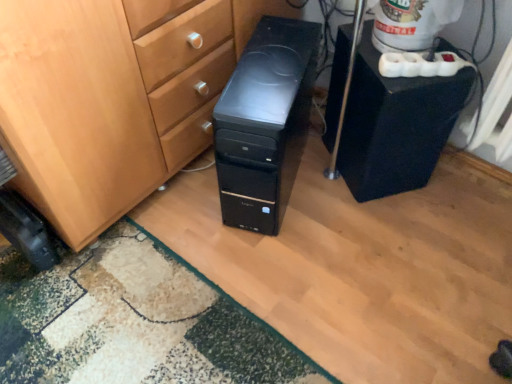
Question: Is point (446, 16) positioned closer to the camera than point (274, 18)?

Choices:
 (A) farther
 (B) closer

Answer: (B)

Question: From the image's perspective, is white plastic water cooler at upper right positioned above or below black plastic computer tower at center?

Choices:
 (A) below
 (B) above

Answer: (B)

Question: Estimate the real-world distances between objects in this image. Which object is closer to the white plastic water cooler at upper right?

Choices:
 (A) black plastic speaker at right
 (B) black rubber wheel at lower left
 (C) green textured rug at lower left
 (D) black plastic computer tower at center

Answer: (A)

Question: Estimate the real-world distances between objects in this image. Which object is closer to the green textured rug at lower left?

Choices:
 (A) black rubber wheel at lower left
 (B) black plastic speaker at right
 (C) white plastic water cooler at upper right
 (D) black plastic computer tower at center

Answer: (A)